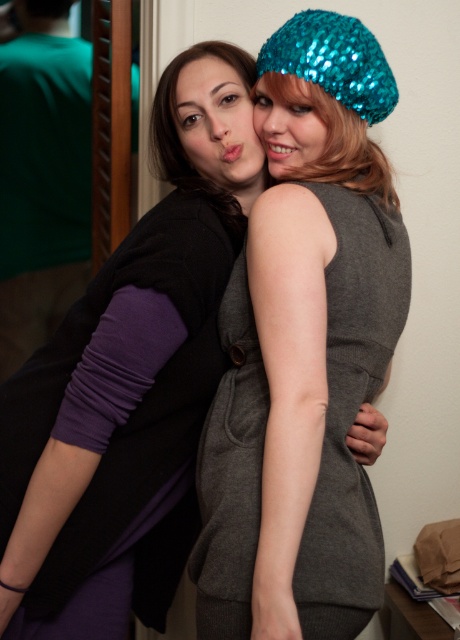
You are a photographer setting up for a group photo. You need to ensure that both the purple fabric at left and the teal sequined beanie at upper right are fully visible in the frame. Based on their sizes, which object might require more space in the camera frame?

The purple fabric at left might require more space in the camera frame since it is wider than the teal sequined beanie at upper right according to the description.

You are taking a photo of two friends. You need to ensure that both the purple matte sweater at left and the matte black face at upper left are clearly visible. Based on their positions, which object is closer to the camera?

The purple matte sweater at left is positioned under the matte black face at upper left, meaning the sweater is closer to the camera than the face.

Looking at this image, you are a photographer trying to capture a closeup shot of the purple matte sweater at left and the teal sequined beanie at upper right. Since you want both items to be in focus, you need to know which one is closer to the camera. Can you determine which item is nearer to the camera?

The purple matte sweater at left is positioned on the left side of teal sequined beanie at upper right, but this spatial relationship does not indicate their distance from the camera. Without additional depth cues, it is impossible to determine which item is closer.